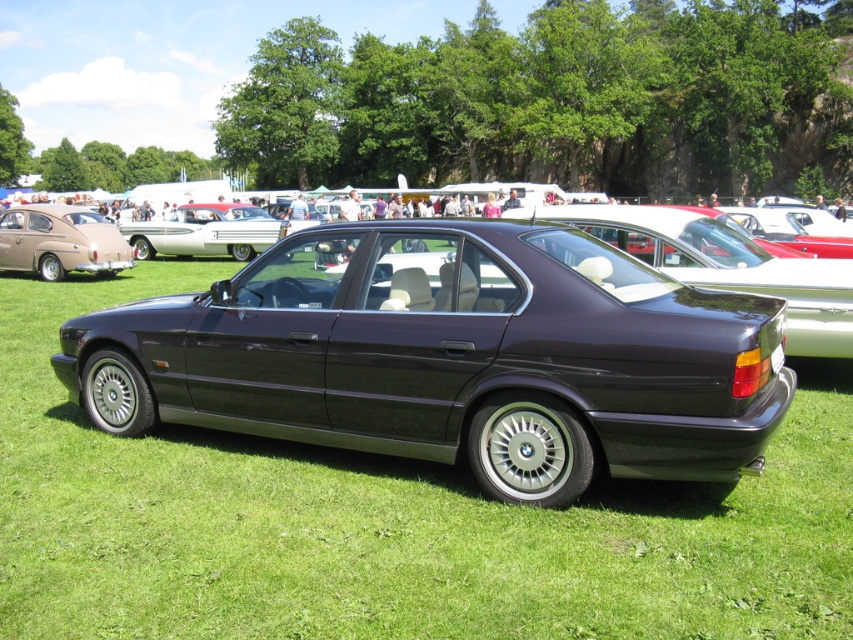
Question: Is satin dark gray car at center positioned in front of satin dark blue sedan at center?

Choices:
 (A) yes
 (B) no

Answer: (A)

Question: Can you confirm if satin dark gray car at center is thinner than matte brown car at left?

Choices:
 (A) yes
 (B) no

Answer: (B)

Question: Which of these objects is positioned farthest from the white glossy sedan at center?

Choices:
 (A) satin dark gray car at center
 (B) matte brown car at left

Answer: (A)

Question: Considering the relative positions of satin dark blue sedan at center and white glossy sedan at center in the image provided, where is satin dark blue sedan at center located with respect to white glossy sedan at center?

Choices:
 (A) above
 (B) below

Answer: (B)

Question: Which point is closer to the camera?

Choices:
 (A) satin dark gray car at center
 (B) satin dark blue sedan at center
 (C) matte brown car at left

Answer: (A)

Question: Which of the following is the closest to the observer?

Choices:
 (A) 190,204
 (B) 30,241
 (C) 585,227
 (D) 643,298

Answer: (D)